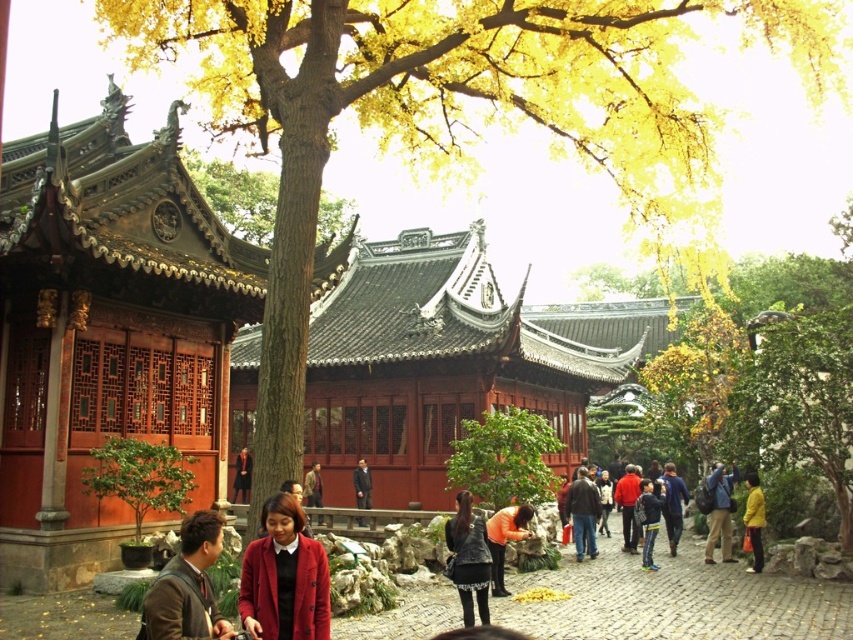
You are standing in a traditional Chinese garden during autumn. You notice two points marked in the scene. The first point is at coordinates point (460, 509) and the second is at point (727, 512). Which point is closer to your current position?

Point (460, 509) is closer to the camera than point (727, 512), so the first point is closer to your current position.

You are a tourist visiting the garden and want to walk along the cobblestone path at center. Considering the height of the green leafy tree at center, will the tree obstruct your view of the buildings in the background while walking on the path?

The cobblestone path at center has a lesser height compared to green leafy tree at center, so the tree is taller than the path. Since the tree is at the same central position as the path, it may block your view of the buildings in the background when walking along the path.